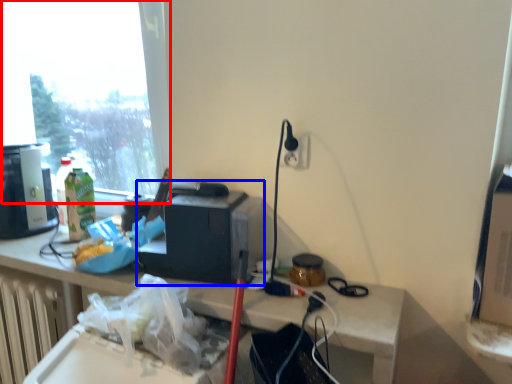
Question: Which point is further to the camera, window (highlighted by a red box) or appliance (highlighted by a blue box)?

Choices:
 (A) window
 (B) appliance

Answer: (A)